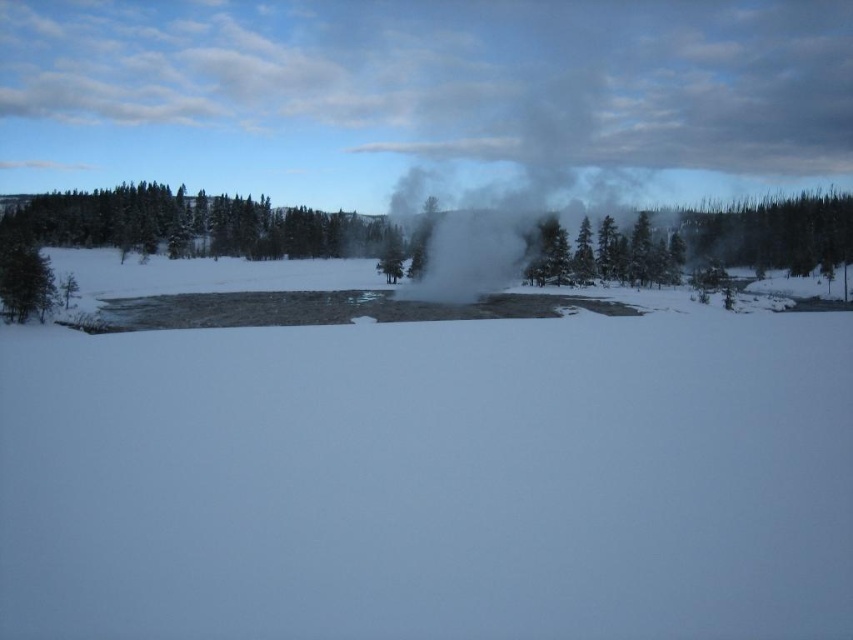
Who is more distant from viewer, [254,244] or [529,214]?

Point [254,244]

Which is below, green matte tree at upper center or white vapor steam at center?

green matte tree at upper center

Image resolution: width=853 pixels, height=640 pixels. Identify the location of green matte tree at upper center. (190, 221).